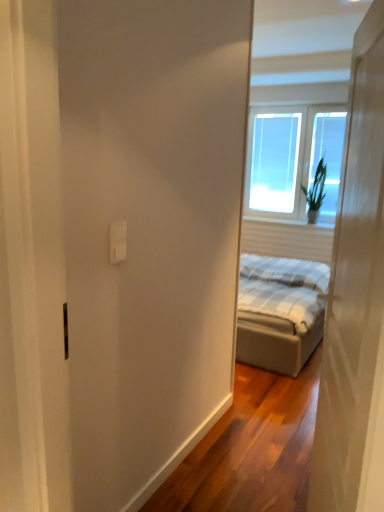
Where is `green leafy plant at upper right`? Image resolution: width=384 pixels, height=512 pixels. green leafy plant at upper right is located at coordinates (316, 187).

In order to face transparent glass window at center, should I rotate leftwards or rightwards?

To align with it, rotate right about 10.958°.

What do you see at coordinates (274, 162) in the screenshot? I see `transparent glass window at center` at bounding box center [274, 162].

The height and width of the screenshot is (512, 384). What are the coordinates of `white matte door at right` in the screenshot? It's located at (355, 300).

Does transparent glass window at upper right contain transparent glass window at center?

Yes, transparent glass window at upper right contains transparent glass window at center.

Is there a large distance between transparent glass window at upper right and transparent glass window at center?

No, transparent glass window at upper right is not far away from transparent glass window at center.

Which is more to the left, transparent glass window at upper right or transparent glass window at center?

transparent glass window at center.

Does point (295, 138) come in front of point (291, 133)?

That is True.

Which of these two, green leafy plant at upper right or white plastic outlet at upper center, is thinner?

Thinner between the two is white plastic outlet at upper center.

Is green leafy plant at upper right not inside white plastic outlet at upper center?

Yes, green leafy plant at upper right is located beyond the bounds of white plastic outlet at upper center.

Locate an element on the screen. The image size is (384, 512). electric outlet below the green leafy plant at upper right (from a real-world perspective) is located at coordinates (118, 241).

Looking at this image, in terms of size, does green leafy plant at upper right appear bigger or smaller than white plastic outlet at upper center?

In the image, green leafy plant at upper right appears to be larger than white plastic outlet at upper center.

Between transparent glass window at center and white plastic outlet at upper center, which one has smaller width?

With smaller width is white plastic outlet at upper center.

Considering the relative positions of transparent glass window at center and white plastic outlet at upper center in the image provided, is transparent glass window at center to the right of white plastic outlet at upper center from the viewer's perspective?

Yes.

Is transparent glass window at center beside white plastic outlet at upper center?

transparent glass window at center is not next to white plastic outlet at upper center, and they're not touching.

Is transparent glass window at center completely or partially outside of white plastic outlet at upper center?

Yes.

Is white plastic outlet at upper center located outside transparent glass window at center?

Yes, white plastic outlet at upper center is not within transparent glass window at center.

Considering the relative sizes of white plastic outlet at upper center and transparent glass window at center in the image provided, is white plastic outlet at upper center taller than transparent glass window at center?

In fact, white plastic outlet at upper center may be shorter than transparent glass window at center.

Are white plastic outlet at upper center and transparent glass window at center making contact?

white plastic outlet at upper center and transparent glass window at center are clearly separated.

Which of these two, white plastic outlet at upper center or transparent glass window at center, is thinner?

white plastic outlet at upper center.

Considering the relative sizes of transparent glass window at upper right and white matte door at right in the image provided, is transparent glass window at upper right thinner than white matte door at right?

Indeed, transparent glass window at upper right has a lesser width compared to white matte door at right.

Is transparent glass window at upper right far from white matte door at right?

Yes, transparent glass window at upper right and white matte door at right are quite far apart.

From a real-world perspective, which is physically above, transparent glass window at upper right or white matte door at right?

transparent glass window at upper right.

In terms of height, does transparent glass window at upper right look taller or shorter compared to white matte door at right?

Considering their sizes, transparent glass window at upper right has less height than white matte door at right.

Considering the relative sizes of white plastic outlet at upper center and transparent glass window at upper right in the image provided, is white plastic outlet at upper center thinner than transparent glass window at upper right?

Yes, white plastic outlet at upper center is thinner than transparent glass window at upper right.

Does white plastic outlet at upper center turn towards transparent glass window at upper right?

No.

From the image's perspective, relative to transparent glass window at upper right, is white plastic outlet at upper center above or below?

white plastic outlet at upper center is situated lower than transparent glass window at upper right in the image.

Which object is positioned more to the left, white plastic outlet at upper center or transparent glass window at upper right?

white plastic outlet at upper center.

What's the angular difference between white matte door at right and transparent glass window at center's facing directions?

80.2 degrees separate the facing orientations of white matte door at right and transparent glass window at center.

From the image's perspective, relative to transparent glass window at center, is white matte door at right above or below?

Clearly, from the image's perspective, white matte door at right is below transparent glass window at center.

Are white matte door at right and transparent glass window at center beside each other?

No.

Does white matte door at right have a smaller size compared to transparent glass window at center?

No, white matte door at right is not smaller than transparent glass window at center.

This screenshot has height=512, width=384. I want to click on window screen on the left of transparent glass window at upper right, so click(274, 162).

In order to click on plant behind the white plastic outlet at upper center in this screenshot , I will do `click(316, 187)`.

Looking at the image, which one is located further to white plastic outlet at upper center, white matte door at right or transparent glass window at upper right?

Among the two, transparent glass window at upper right is located further to white plastic outlet at upper center.

When comparing their distances from white plastic outlet at upper center, does green leafy plant at upper right or transparent glass window at center seem closer?

Among the two, green leafy plant at upper right is located nearer to white plastic outlet at upper center.

Considering their positions, is green leafy plant at upper right positioned further to transparent glass window at center than transparent glass window at upper right?

Among the two, green leafy plant at upper right is located further to transparent glass window at center.

Which object lies nearer to the anchor point transparent glass window at upper right, green leafy plant at upper right or white plastic outlet at upper center?

Among the two, green leafy plant at upper right is located nearer to transparent glass window at upper right.

Which object lies nearer to the anchor point transparent glass window at upper right, transparent glass window at center or white matte door at right?

transparent glass window at center is positioned closer to the anchor transparent glass window at upper right.

From the picture: Estimate the real-world distances between objects in this image. Which object is further from white matte door at right, green leafy plant at upper right or transparent glass window at upper right?

The object further to white matte door at right is green leafy plant at upper right.

When comparing their distances from green leafy plant at upper right, does transparent glass window at center or transparent glass window at upper right seem further?

transparent glass window at center lies further to green leafy plant at upper right than the other object.

Looking at the image, which one is located closer to transparent glass window at upper right, white matte door at right or transparent glass window at center?

transparent glass window at center.

At what (x,y) coordinates should I click in order to perform the action: click on window located between white plastic outlet at upper center and green leafy plant at upper right in the depth direction. Please return your answer as a coordinate pair (x, y). Image resolution: width=384 pixels, height=512 pixels. Looking at the image, I should click on (292, 159).

Identify the location of plant between white plastic outlet at upper center and transparent glass window at center in the front-back direction. (316, 187).

Identify the location of window between white matte door at right and green leafy plant at upper right along the z-axis. (292, 159).

Locate an element on the screen. plant between white matte door at right and transparent glass window at center from front to back is located at coordinates (316, 187).